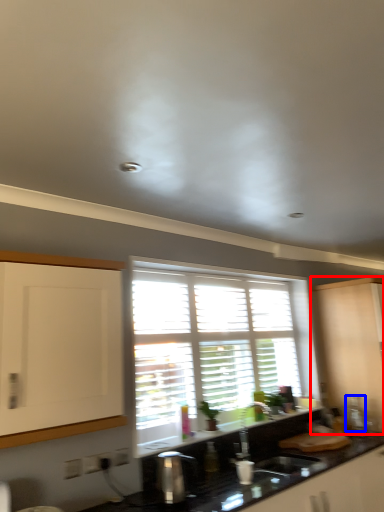
Question: Which object appears farthest to the camera in this image, cabinetry (highlighted by a red box) or appliance (highlighted by a blue box)?

Choices:
 (A) cabinetry
 (B) appliance

Answer: (B)